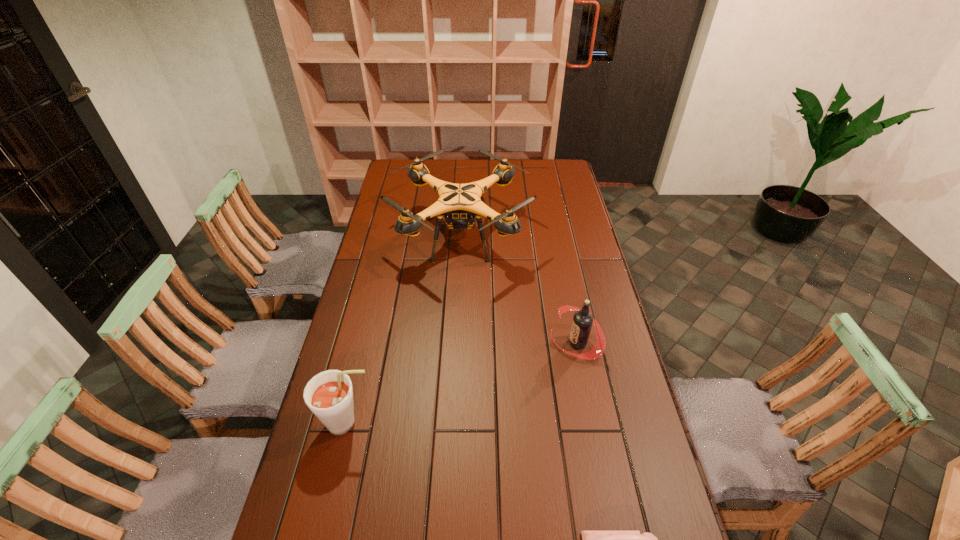
Locate an element on the screen. The width and height of the screenshot is (960, 540). free region located on the label of the second farthest object is located at coordinates click(x=524, y=342).

You are a GUI agent. You are given a task and a screenshot of the screen. Output one action in this format:
    pyautogui.click(x=<x>, y=<y>)
    Task: Click on the drone present at the left edge
    
    Given the screenshot: What is the action you would take?
    pyautogui.click(x=462, y=205)

Where is `root beer situated at the left edge`? The width and height of the screenshot is (960, 540). root beer situated at the left edge is located at coordinates (329, 395).

Identify the location of object located at the right edge. (x=582, y=322).

Image resolution: width=960 pixels, height=540 pixels. In the image, there is a desktop. Identify the location of free space at the left edge. (385, 248).

Identify the location of vacant space at the right edge of the desktop. The height and width of the screenshot is (540, 960). (577, 207).

Where is `vacant space that is in between the farther root beer and the nearer root beer`? Image resolution: width=960 pixels, height=540 pixels. vacant space that is in between the farther root beer and the nearer root beer is located at coordinates (463, 383).

Where is `vacant space that is in between the farthest object and the nearer root beer`? vacant space that is in between the farthest object and the nearer root beer is located at coordinates (404, 330).

Find the location of a particular element. vacant area that lies between the second nearest object and the second farthest object is located at coordinates (463, 383).

Locate an element on the screen. This screenshot has width=960, height=540. vacant area that lies between the right root beer and the nearer root beer is located at coordinates (463, 383).